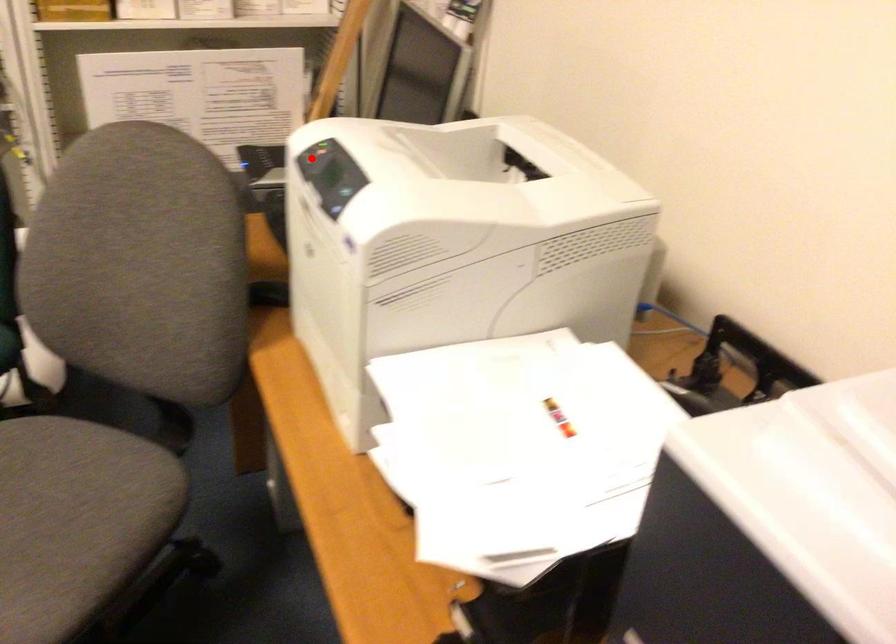
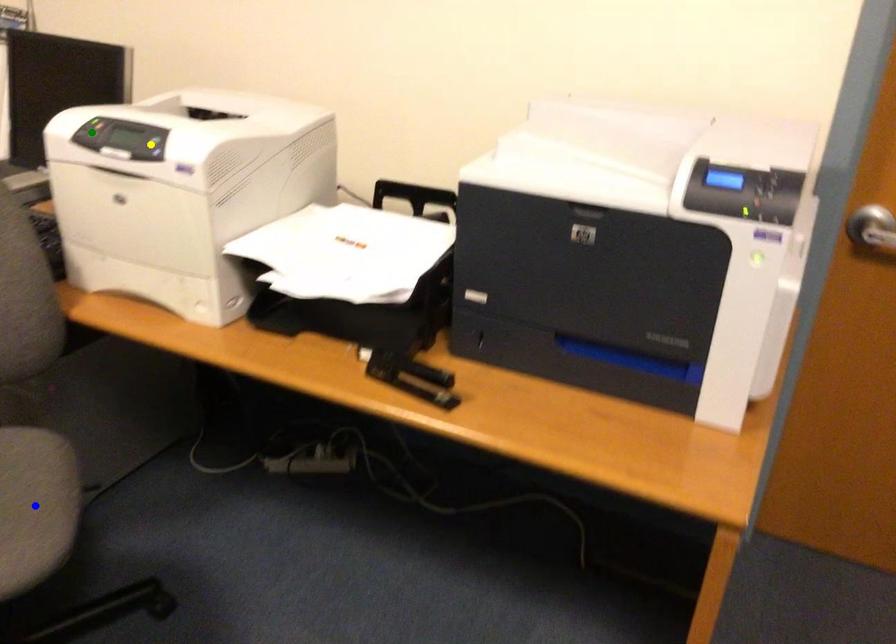
Question: I am providing you with two images of the same scene from different viewpoints. A red point is marked on the first image. You are given multiple points on the second image. Can you choose the point in image 2 that corresponds to the point in image 1?

Choices:
 (A) green point
 (B) blue point
 (C) yellow point

Answer: (A)